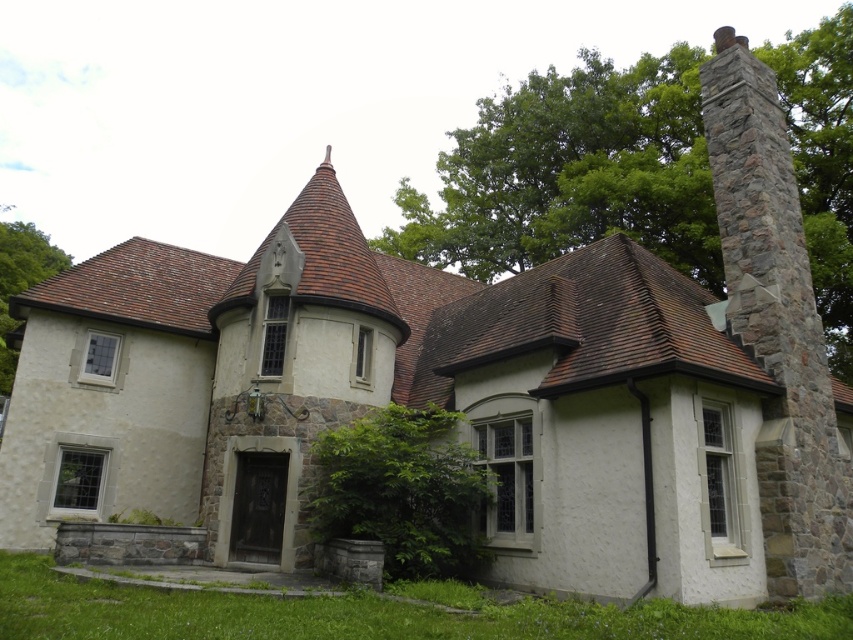
You are standing in front of the house and notice a point marked at coordinates (572, 172). What object is located at this point?

The point at coordinates (572, 172) corresponds to the green leafy tree at upper right.